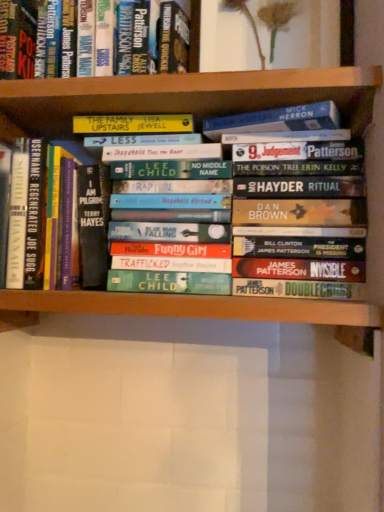
Image resolution: width=384 pixels, height=512 pixels. What do you see at coordinates (6, 34) in the screenshot? I see `hardcover book at upper left` at bounding box center [6, 34].

Identify the location of hardcover book at upper left. (6, 34).

Find the location of a particular element. hardcover book at upper left is located at coordinates (6, 34).